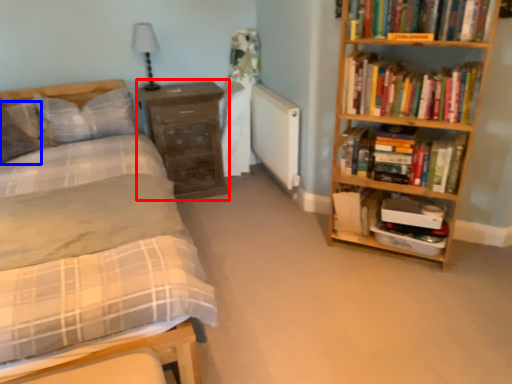
Question: Which of the following is the closest to the observer, chest of drawers (highlighted by a red box) or pillow (highlighted by a blue box)?

Choices:
 (A) chest of drawers
 (B) pillow

Answer: (B)